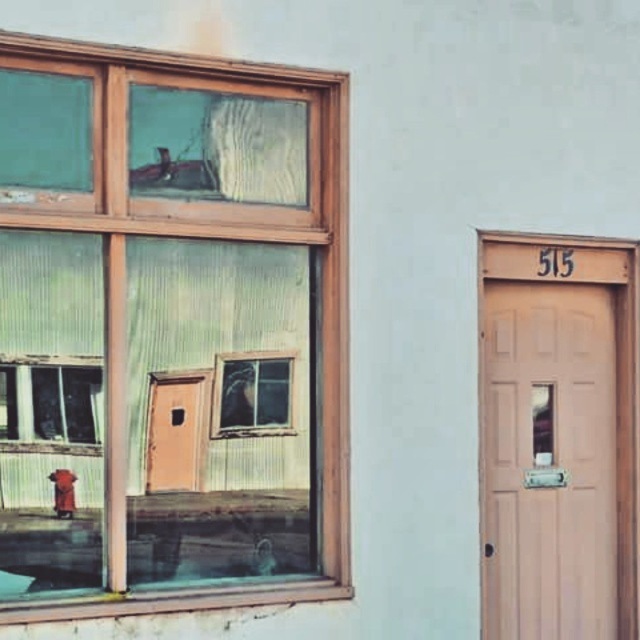
You are a delivery person trying to locate the entrance to the building. You see the matte wood door at right and the brass metallic hydrant at lower left. Which object is closer to the entrance?

The matte wood door at right is positioned over the brass metallic hydrant at lower left, meaning it is closer to the entrance.

You are a painter who needs to decide which object to paint first. Based on their sizes, which one should you tackle first, the clear glass window at upper left or the brass metallic hydrant at lower left?

The clear glass window at upper left is much taller than the brass metallic hydrant at lower left, so you should paint the clear glass window at upper left first because it is larger in height.

Based on the provided image description, what object is positioned at the coordinates point (170, 330)?

The clear glass window at upper left is located at point (170, 330).